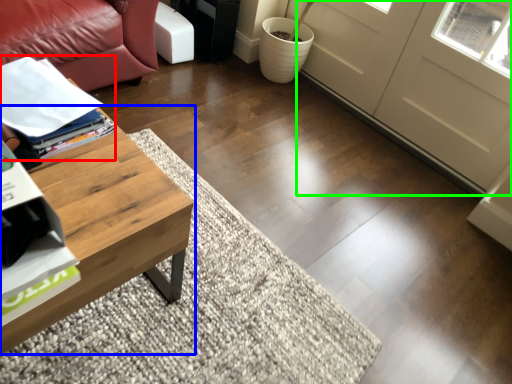
Question: Based on their relative distances, which object is nearer to magazine (highlighted by a red box)? Choose from coffee table (highlighted by a blue box) and screen door (highlighted by a green box).

Choices:
 (A) coffee table
 (B) screen door

Answer: (A)